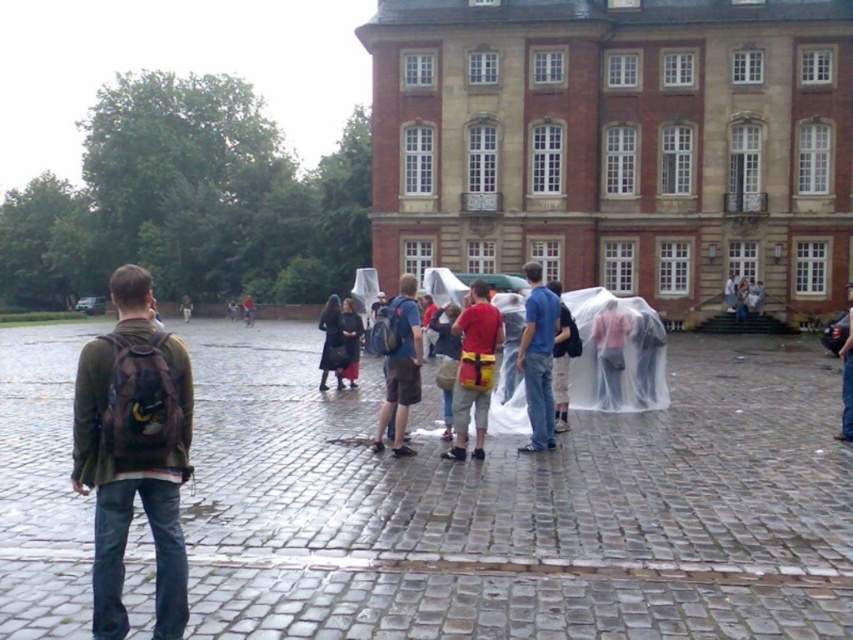
Does red fabric backpack at center lie in front of jeans at center?

That is True.

At what (x,y) coordinates should I click in order to perform the action: click on red fabric backpack at center. Please return your answer as a coordinate pair (x, y). The height and width of the screenshot is (640, 853). Looking at the image, I should click on (474, 369).

Who is positioned more to the right, red brick palace at center or blue backpack at center?

Positioned to the right is red brick palace at center.

Is red brick palace at center positioned behind blue backpack at center?

Yes, red brick palace at center is behind blue backpack at center.

Find the location of `red brick palace at center`. red brick palace at center is located at coordinates (618, 144).

Find the location of a particular element. red fabric backpack at center is located at coordinates (474, 369).

Who is taller, red fabric backpack at center or dark gray fabric coat at center?

Standing taller between the two is red fabric backpack at center.

Which is behind, point (497, 323) or point (345, 310)?

The point (345, 310) is behind.

Find the location of a particular element. Image resolution: width=853 pixels, height=640 pixels. red fabric backpack at center is located at coordinates (474, 369).